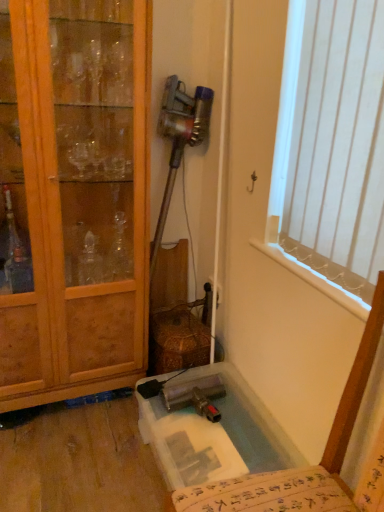
Question: From the image's perspective, does wooden cabinet at left appear higher than white vertical blinds at upper right?

Choices:
 (A) no
 (B) yes

Answer: (A)

Question: Is wooden cabinet at left not near white vertical blinds at upper right?

Choices:
 (A) yes
 (B) no

Answer: (B)

Question: Are wooden cabinet at left and white vertical blinds at upper right beside each other?

Choices:
 (A) yes
 (B) no

Answer: (B)

Question: From the image's perspective, is wooden cabinet at left beneath white vertical blinds at upper right?

Choices:
 (A) no
 (B) yes

Answer: (B)

Question: Does wooden cabinet at left have a larger size compared to white vertical blinds at upper right?

Choices:
 (A) yes
 (B) no

Answer: (A)

Question: From their relative heights in the image, would you say clear plastic bath at lower center is taller or shorter than wooden cabinet at left?

Choices:
 (A) short
 (B) tall

Answer: (A)

Question: From a real-world perspective, is clear plastic bath at lower center physically located above or below wooden cabinet at left?

Choices:
 (A) above
 (B) below

Answer: (B)

Question: Would you say clear plastic bath at lower center is inside or outside wooden cabinet at left?

Choices:
 (A) outside
 (B) inside

Answer: (A)

Question: From the image's perspective, is clear plastic bath at lower center above or below wooden cabinet at left?

Choices:
 (A) above
 (B) below

Answer: (B)

Question: Choose the correct answer: Is wooden cabinet at left inside translucent plastic chair at lower right or outside it?

Choices:
 (A) inside
 (B) outside

Answer: (B)

Question: Considering the positions of wooden cabinet at left and translucent plastic chair at lower right in the image, is wooden cabinet at left taller or shorter than translucent plastic chair at lower right?

Choices:
 (A) tall
 (B) short

Answer: (A)

Question: In the image, is wooden cabinet at left positioned in front of or behind translucent plastic chair at lower right?

Choices:
 (A) front
 (B) behind

Answer: (B)

Question: Considering the positions of wooden cabinet at left and translucent plastic chair at lower right in the image, is wooden cabinet at left bigger or smaller than translucent plastic chair at lower right?

Choices:
 (A) small
 (B) big

Answer: (B)

Question: Based on their sizes in the image, would you say translucent plastic chair at lower right is bigger or smaller than white vertical blinds at upper right?

Choices:
 (A) small
 (B) big

Answer: (B)

Question: From a real-world perspective, is translucent plastic chair at lower right physically located above or below white vertical blinds at upper right?

Choices:
 (A) above
 (B) below

Answer: (B)